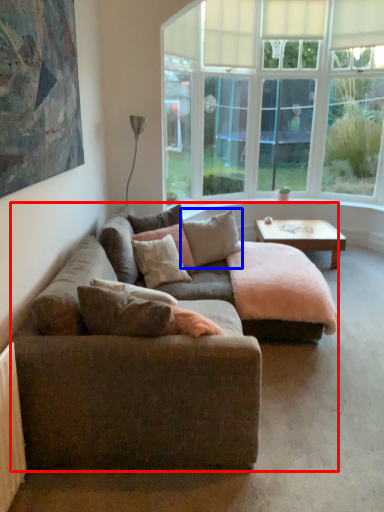
Question: Which of the following is the farthest to the observer, studio couch (highlighted by a red box) or pillow (highlighted by a blue box)?

Choices:
 (A) studio couch
 (B) pillow

Answer: (B)